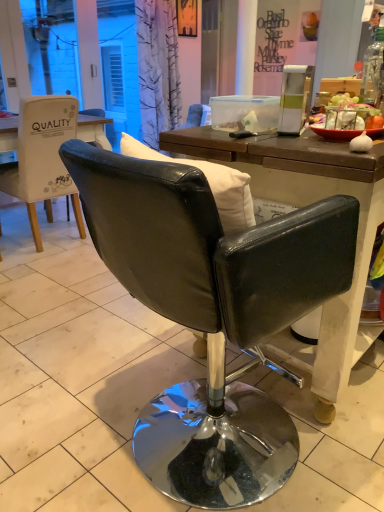
Measure the distance between black leather chair at center, which is the second chair in back-to-front order, and camera.

black leather chair at center, which is the second chair in back-to-front order, is 28.21 inches from camera.

The width and height of the screenshot is (384, 512). What do you see at coordinates (271, 42) in the screenshot?
I see `matte black sign at upper center` at bounding box center [271, 42].

Where is `white leather chair at left, the 2th chair from the front`? Image resolution: width=384 pixels, height=512 pixels. white leather chair at left, the 2th chair from the front is located at coordinates pos(43,158).

I want to click on black leather chair at center, which is the 1th chair from front to back, so click(212, 313).

Considering their positions, is transparent glass bottle at upper right located in front of or behind black leather chair at center, arranged as the 1th chair when viewed from the right?

transparent glass bottle at upper right is behind black leather chair at center, arranged as the 1th chair when viewed from the right.

Consider the image. Can we say transparent glass bottle at upper right lies outside black leather chair at center, which is the second chair in back-to-front order?

Yes.

Who is taller, transparent glass bottle at upper right or black leather chair at center, which is the 1th chair from front to back?

Standing taller between the two is black leather chair at center, which is the 1th chair from front to back.

Is transparent glass bottle at upper right facing towards black leather chair at center, marked as the second chair in a left-to-right arrangement?

No, transparent glass bottle at upper right does not turn towards black leather chair at center, marked as the second chair in a left-to-right arrangement.

Based on their sizes in the image, would you say black leather chair at center, arranged as the 1th chair when viewed from the right, is bigger or smaller than white leather chair at left, the first chair from the left?

black leather chair at center, arranged as the 1th chair when viewed from the right, is bigger than white leather chair at left, the first chair from the left.

Does black leather chair at center, which is the 1th chair from front to back, touch white leather chair at left, the 2th chair from the front?

black leather chair at center, which is the 1th chair from front to back, and white leather chair at left, the 2th chair from the front, are clearly separated.

How far apart are black leather chair at center, which is the second chair in back-to-front order, and white leather chair at left, the 2th chair from the front?

A distance of 1.88 meters exists between black leather chair at center, which is the second chair in back-to-front order, and white leather chair at left, the 2th chair from the front.

Between black leather chair at center, marked as the second chair in a left-to-right arrangement, and white leather chair at left, the first chair from the left, which one has more height?

white leather chair at left, the first chair from the left, is taller.

From a real-world perspective, is white leather chair at left, acting as the first chair starting from the back, positioned over transparent glass bottle at upper right based on gravity?

No.

From the image's perspective, would you say white leather chair at left, which is the 2th chair from right to left, is positioned over transparent glass bottle at upper right?

No, from the image's perspective, white leather chair at left, which is the 2th chair from right to left, is not over transparent glass bottle at upper right.

Is white leather chair at left, which is the 2th chair from right to left, completely or partially outside of matte black sign at upper center?

Yes, white leather chair at left, which is the 2th chair from right to left, is not within matte black sign at upper center.

Considering the positions of objects white leather chair at left, the 2th chair from the front, and matte black sign at upper center in the image provided, who is more to the right, white leather chair at left, the 2th chair from the front, or matte black sign at upper center?

matte black sign at upper center.

From a real-world perspective, does white leather chair at left, the 2th chair from the front, sit lower than black leather chair at center, which is the second chair in back-to-front order?

No, from a real-world perspective, white leather chair at left, the 2th chair from the front, is not beneath black leather chair at center, which is the second chair in back-to-front order.

Is white leather chair at left, the 2th chair from the front, thinner than black leather chair at center, marked as the second chair in a left-to-right arrangement?

Correct, the width of white leather chair at left, the 2th chair from the front, is less than that of black leather chair at center, marked as the second chair in a left-to-right arrangement.

Is point (39, 147) closer to camera compared to point (89, 157)?

No, (39, 147) is further to viewer.

From a real-world perspective, is matte black sign at upper center physically below transparent glass bottle at upper right?

No, from a real-world perspective, matte black sign at upper center is not beneath transparent glass bottle at upper right.

From the image's perspective, between matte black sign at upper center and transparent glass bottle at upper right, who is located below?

transparent glass bottle at upper right, from the image's perspective.

Considering the positions of objects matte black sign at upper center and transparent glass bottle at upper right in the image provided, who is in front, matte black sign at upper center or transparent glass bottle at upper right?

transparent glass bottle at upper right.

In the image, there is a black leather chair at center, marked as the second chair in a left-to-right arrangement. Where is `writing above it (from the image's perspective)`? This screenshot has width=384, height=512. writing above it (from the image's perspective) is located at coordinates (271, 42).

How far apart are black leather chair at center, marked as the second chair in a left-to-right arrangement, and matte black sign at upper center?

black leather chair at center, marked as the second chair in a left-to-right arrangement, is 4.68 meters from matte black sign at upper center.

Can we say black leather chair at center, arranged as the 1th chair when viewed from the right, lies outside matte black sign at upper center?

Yes, black leather chair at center, arranged as the 1th chair when viewed from the right, is outside of matte black sign at upper center.

Is black leather chair at center, arranged as the 1th chair when viewed from the right, wider or thinner than matte black sign at upper center?

Clearly, black leather chair at center, arranged as the 1th chair when viewed from the right, has more width compared to matte black sign at upper center.

Identify the location of bottle located behind the black leather chair at center, arranged as the 1th chair when viewed from the right. 372,69.

This screenshot has width=384, height=512. In the image, there is a white leather chair at left, the first chair from the left. What are the coordinates of `chair below it (from a real-world perspective)` in the screenshot? It's located at (212, 313).

Considering their positions, is white leather chair at left, which is the 2th chair from right to left, positioned further to black leather chair at center, which is the second chair in back-to-front order, than matte black sign at upper center?

matte black sign at upper center is further to black leather chair at center, which is the second chair in back-to-front order.

Which object lies nearer to the anchor point white leather chair at left, which is the 2th chair from right to left, black leather chair at center, marked as the second chair in a left-to-right arrangement, or matte black sign at upper center?

Based on the image, black leather chair at center, marked as the second chair in a left-to-right arrangement, appears to be nearer to white leather chair at left, which is the 2th chair from right to left.

Based on their spatial positions, is matte black sign at upper center or white leather chair at left, the 2th chair from the front, closer to transparent glass bottle at upper right?

white leather chair at left, the 2th chair from the front, is positioned closer to the anchor transparent glass bottle at upper right.

From the picture: Looking at the image, which one is located closer to matte black sign at upper center, black leather chair at center, which is the second chair in back-to-front order, or transparent glass bottle at upper right?

transparent glass bottle at upper right lies closer to matte black sign at upper center than the other object.

Considering their positions, is transparent glass bottle at upper right positioned closer to white leather chair at left, the first chair from the left, than black leather chair at center, which is the 1th chair from front to back?

black leather chair at center, which is the 1th chair from front to back, lies closer to white leather chair at left, the first chair from the left, than the other object.

Consider the image. Based on their spatial positions, is transparent glass bottle at upper right or matte black sign at upper center closer to white leather chair at left, acting as the first chair starting from the back?

transparent glass bottle at upper right lies closer to white leather chair at left, acting as the first chair starting from the back, than the other object.

When comparing their distances from matte black sign at upper center, does black leather chair at center, which is the 1th chair from front to back, or white leather chair at left, acting as the first chair starting from the back, seem closer?

white leather chair at left, acting as the first chair starting from the back, is positioned closer to the anchor matte black sign at upper center.

Looking at the image, which one is located further to black leather chair at center, which is the second chair in back-to-front order, white leather chair at left, the first chair from the left, or transparent glass bottle at upper right?

The object further to black leather chair at center, which is the second chair in back-to-front order, is white leather chair at left, the first chair from the left.

You are a GUI agent. You are given a task and a screenshot of the screen. Output one action in this format:
    pyautogui.click(x=<x>, y=<y>)
    Task: Click on the bottle between black leather chair at center, marked as the second chair in a left-to-right arrangement, and matte black sign at upper center, along the z-axis
    The width and height of the screenshot is (384, 512).
    Given the screenshot: What is the action you would take?
    pyautogui.click(x=372, y=69)

The width and height of the screenshot is (384, 512). In order to click on chair between black leather chair at center, which is the second chair in back-to-front order, and matte black sign at upper center from front to back in this screenshot , I will do (x=43, y=158).

Identify the location of chair between white leather chair at left, acting as the first chair starting from the back, and transparent glass bottle at upper right from left to right. (212, 313).

Identify the location of chair located between transparent glass bottle at upper right and matte black sign at upper center in the depth direction. The height and width of the screenshot is (512, 384). (43, 158).